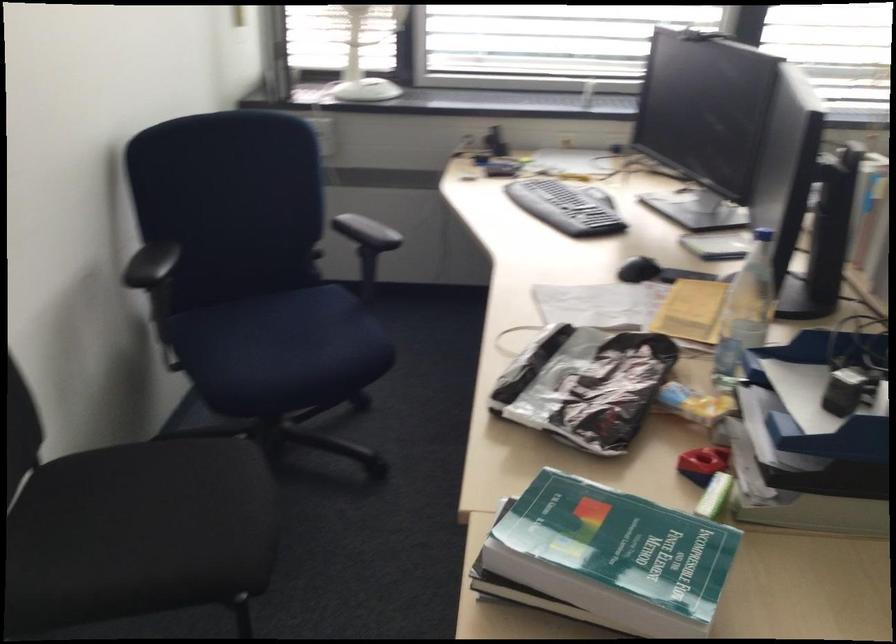
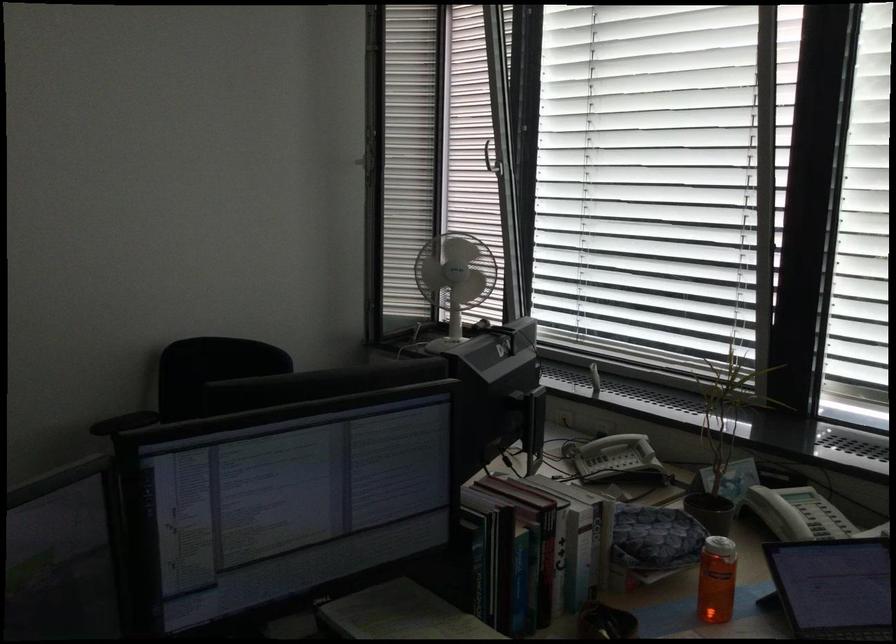
Question: I am providing you with two images of the same scene from different viewpoints. After the viewpoint changes to image2, which objects are now occluded?

Choices:
 (A) silver window handle
 (B) red book
 (C) white bin rim
 (D) plastic water bottle

Answer: (D)